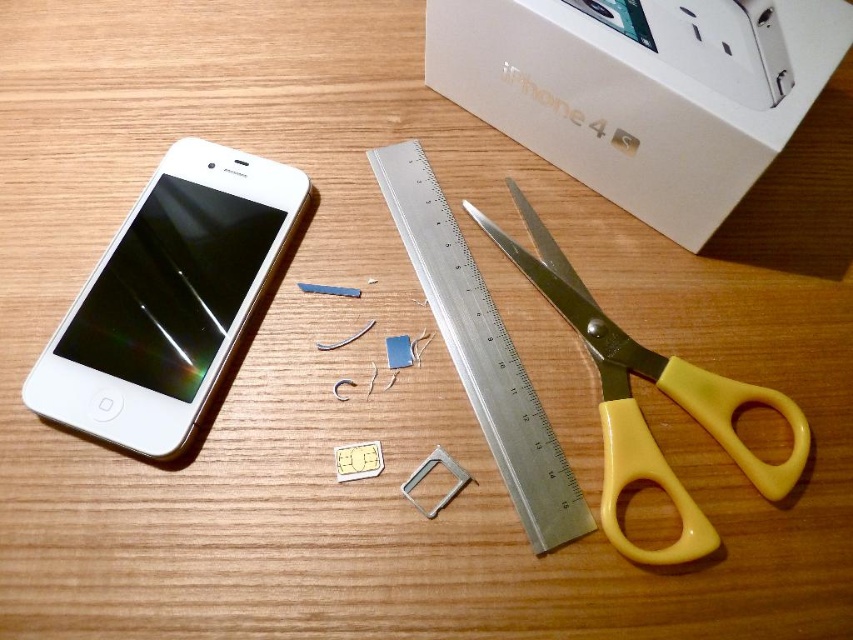
You are organizing a workshop and need to place the white cardboard box at upper center and the silver metallic ruler at center into a storage container. Which object has a greater width and will require more space horizontally?

The white cardboard box at upper center has a greater width than the silver metallic ruler at center, so it will require more horizontal space.

You need to place both the white matte smartphone at left and the silver metallic ruler at center into a storage box that can only accommodate items up to the size of the ruler. Which item might not fit, and why?

The white matte smartphone at left might not fit because its width is larger than the silver metallic ruler at center, which is the maximum allowed size for the storage box.